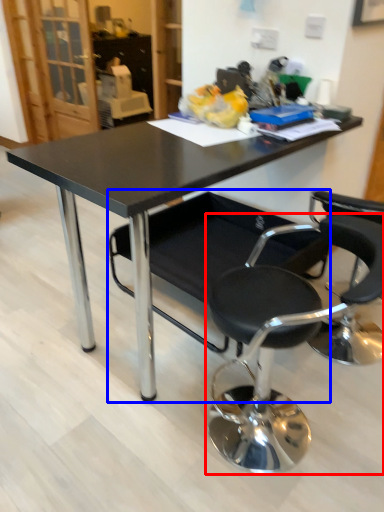
Question: Among these objects, which one is farthest to the camera, chair (highlighted by a red box) or chair (highlighted by a blue box)?

Choices:
 (A) chair
 (B) chair

Answer: (B)